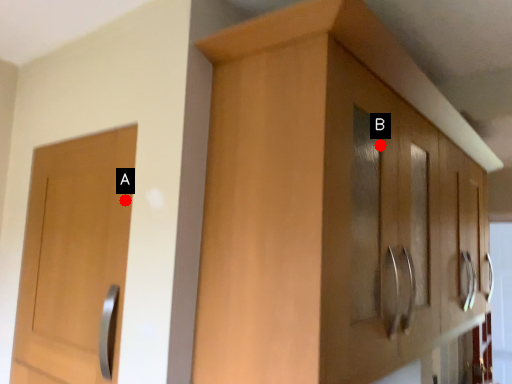
Question: Two points are circled on the image, labeled by A and B beside each circle. Which of the following is the farthest from the observer?

Choices:
 (A) A is further
 (B) B is further

Answer: (B)